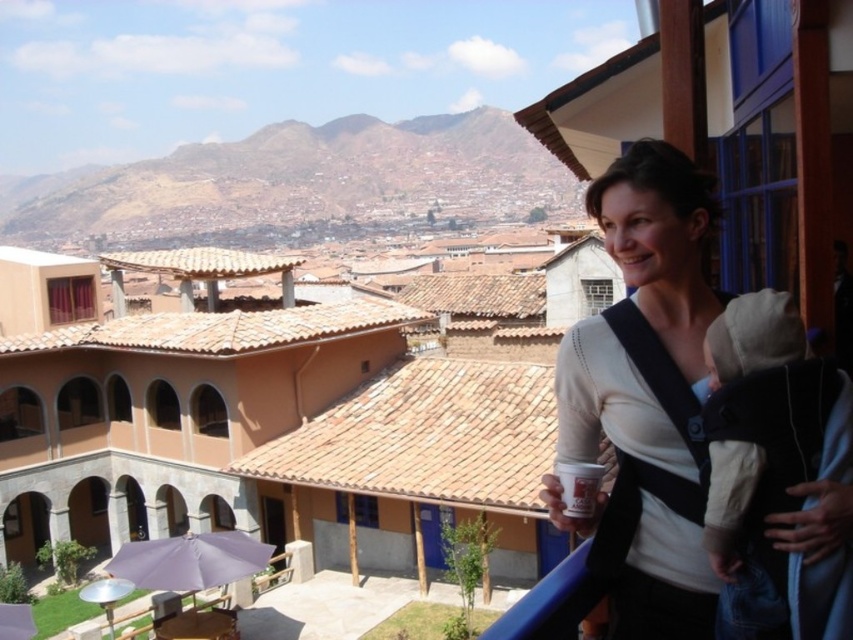
Question: Does white matte sweater at upper right come behind purple fabric umbrella at lower left?

Choices:
 (A) yes
 (B) no

Answer: (B)

Question: Among these objects, which one is farthest from the camera?

Choices:
 (A) white matte sweater at upper right
 (B) purple fabric umbrella at lower left

Answer: (B)

Question: Observing the image, what is the correct spatial positioning of white matte sweater at upper right in reference to purple fabric umbrella at lower left?

Choices:
 (A) right
 (B) left

Answer: (A)

Question: Which of the following is the farthest from the observer?

Choices:
 (A) (639, 602)
 (B) (189, 589)

Answer: (B)

Question: Does white matte sweater at upper right appear on the left side of purple fabric umbrella at lower left?

Choices:
 (A) yes
 (B) no

Answer: (B)